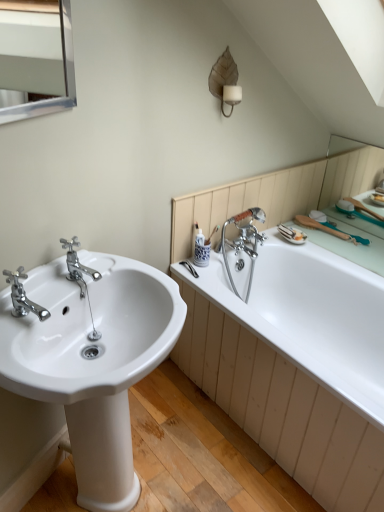
Question: Is white glossy bathtub at right oriented towards matte brown leaf-shaped sconce at upper center?

Choices:
 (A) no
 (B) yes

Answer: (A)

Question: Is there a large distance between white glossy bathtub at right and matte brown leaf-shaped sconce at upper center?

Choices:
 (A) yes
 (B) no

Answer: (B)

Question: Is white glossy bathtub at right outside of matte brown leaf-shaped sconce at upper center?

Choices:
 (A) yes
 (B) no

Answer: (A)

Question: Is matte brown leaf-shaped sconce at upper center at the back of white glossy bathtub at right?

Choices:
 (A) yes
 (B) no

Answer: (B)

Question: Does white glossy bathtub at right touch matte brown leaf-shaped sconce at upper center?

Choices:
 (A) yes
 (B) no

Answer: (B)

Question: From the image's perspective, is white glossy bathtub at right above matte brown leaf-shaped sconce at upper center?

Choices:
 (A) yes
 (B) no

Answer: (B)

Question: From the image's perspective, does matte brown leaf-shaped sconce at upper center appear lower than chrome metallic faucet at left, which appears as the 2th tap when viewed from the back?

Choices:
 (A) yes
 (B) no

Answer: (B)

Question: Considering the relative sizes of matte brown leaf-shaped sconce at upper center and chrome metallic faucet at left, which appears as the 2th tap when viewed from the back, in the image provided, is matte brown leaf-shaped sconce at upper center thinner than chrome metallic faucet at left, which appears as the 2th tap when viewed from the back,?

Choices:
 (A) no
 (B) yes

Answer: (B)

Question: Are matte brown leaf-shaped sconce at upper center and chrome metallic faucet at left, marked as the first tap in a front-to-back arrangement, making contact?

Choices:
 (A) no
 (B) yes

Answer: (A)

Question: Is matte brown leaf-shaped sconce at upper center completely or partially outside of chrome metallic faucet at left, marked as the first tap in a front-to-back arrangement?

Choices:
 (A) no
 (B) yes

Answer: (B)

Question: From the image's perspective, is matte brown leaf-shaped sconce at upper center above chrome metallic faucet at left, which appears as the 2th tap when viewed from the back?

Choices:
 (A) no
 (B) yes

Answer: (B)

Question: Is the position of matte brown leaf-shaped sconce at upper center more distant than that of chrome metallic faucet at left, marked as the first tap in a front-to-back arrangement?

Choices:
 (A) no
 (B) yes

Answer: (B)

Question: Considering the relative positions of white glossy bathtub at right and chrome metallic faucet at left, which appears as the 2th tap when viewed from the back, in the image provided, is white glossy bathtub at right behind chrome metallic faucet at left, which appears as the 2th tap when viewed from the back,?

Choices:
 (A) yes
 (B) no

Answer: (A)